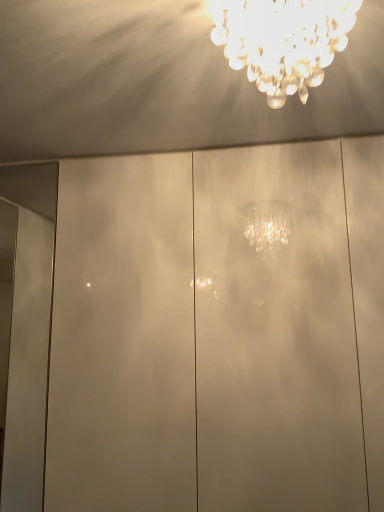
Question: From their relative heights in the image, would you say glossy white glass door at center is taller or shorter than white glossy door at left?

Choices:
 (A) tall
 (B) short

Answer: (A)

Question: Considering the positions of glossy white glass door at center and white glossy door at left in the image, is glossy white glass door at center wider or thinner than white glossy door at left?

Choices:
 (A) wide
 (B) thin

Answer: (A)

Question: Estimate the real-world distances between objects in this image. Which object is closer to the white glossy door at left?

Choices:
 (A) clear crystal chandelier at upper center
 (B) glossy white glass door at center

Answer: (B)

Question: Based on their relative distances, which object is farther from the clear crystal chandelier at upper center?

Choices:
 (A) glossy white glass door at center
 (B) white glossy door at left

Answer: (B)